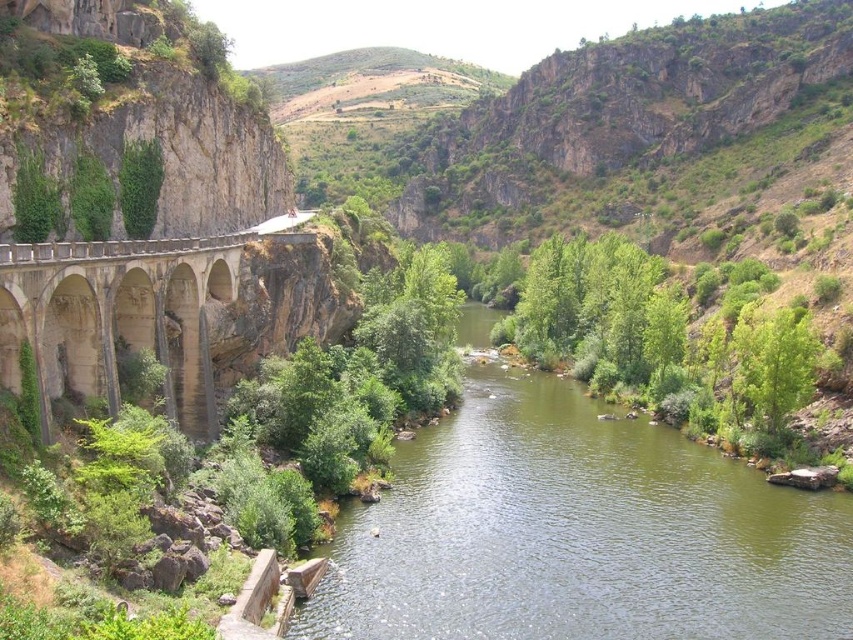
You are a hiker standing on the beige stone bridge at left and want to cross to the other side. The green smooth water at center is flowing beneath you. How does the height of the water compare to the bridge?

The green smooth water at center has a lesser height compared to the beige stone bridge at left, so the water is lower than the bridge.